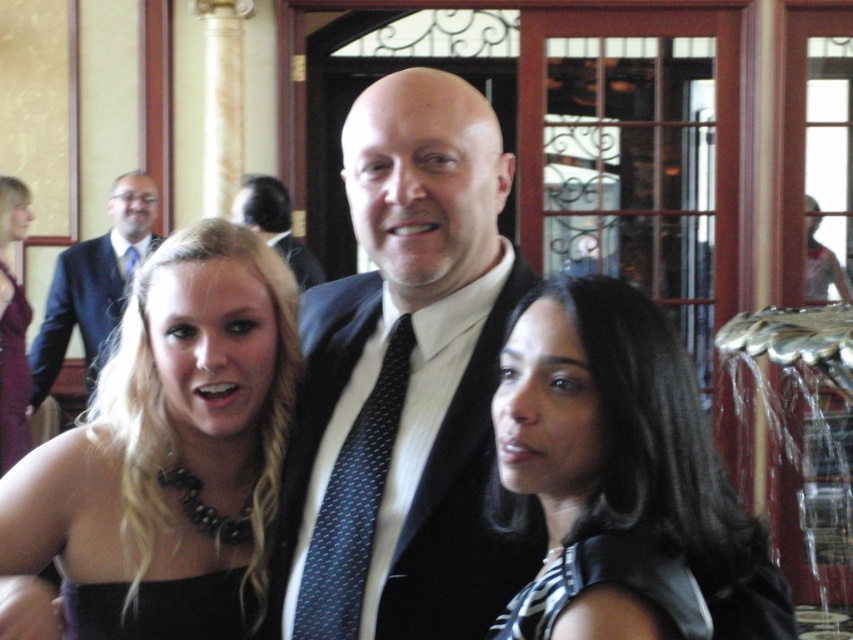
You are a photographer adjusting your camera settings. You need to focus on the dark blue textured suit at center and the black satin dress at lower left. Which one should you focus on first to ensure both are in sharp focus?

The dark blue textured suit at center is in front of the black satin dress at lower left, so you should focus on the dark blue textured suit at center first to ensure both are in sharp focus.

You are a photographer adjusting your camera settings to focus on the dark blue textured suit at center. Based on the coordinates provided, is the suit positioned closer to the left or right side of the image?

The dark blue textured suit at center is located at point 0.581 on the x and y axis, which places it closer to the right side of the image.